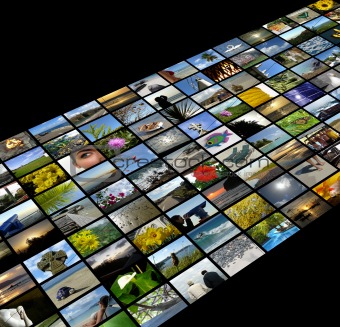
Where is `bottom row of screens`? The width and height of the screenshot is (340, 327). bottom row of screens is located at coordinates 119,322, 165,300, 210,271, 250,256, 269,236, 325,190, 313,207.